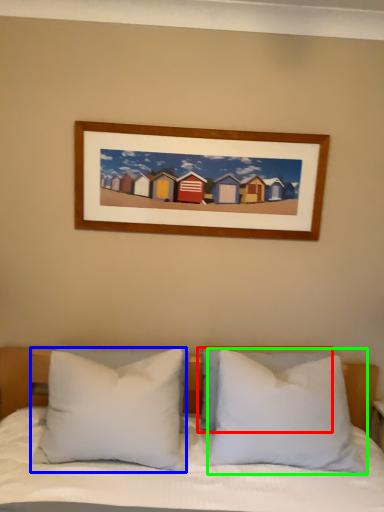
Question: Estimate the real-world distances between objects in this image. Which object is closer to pillow (highlighted by a red box), pillow (highlighted by a blue box) or pillow (highlighted by a green box)?

Choices:
 (A) pillow
 (B) pillow

Answer: (B)